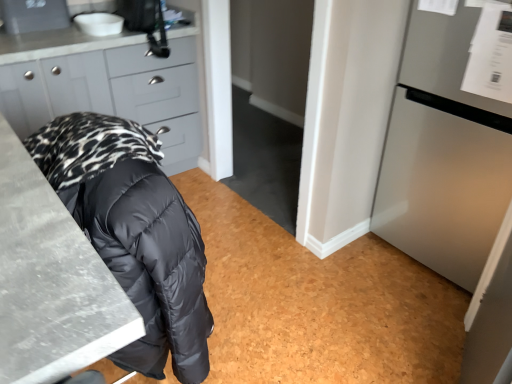
Where is `free point in front of white glossy sink at upper left`? free point in front of white glossy sink at upper left is located at coordinates coord(74,41).